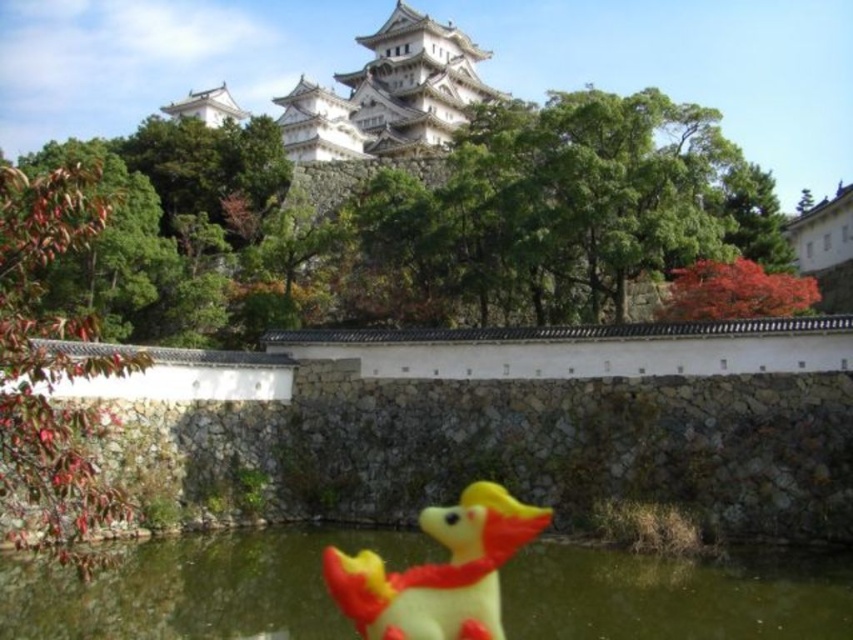
Question: Which of the following is the farthest from the observer?

Choices:
 (A) translucent plastic water at center
 (B) yellow rubber duck at lower center

Answer: (B)

Question: Among these points, which one is nearest to the camera?

Choices:
 (A) (483, 605)
 (B) (236, 556)

Answer: (A)

Question: Does translucent plastic water at center have a smaller size compared to yellow rubber duck at lower center?

Choices:
 (A) yes
 (B) no

Answer: (B)

Question: Is translucent plastic water at center to the right of yellow rubber duck at lower center from the viewer's perspective?

Choices:
 (A) no
 (B) yes

Answer: (A)

Question: In this image, where is translucent plastic water at center located relative to yellow rubber duck at lower center?

Choices:
 (A) below
 (B) above

Answer: (B)